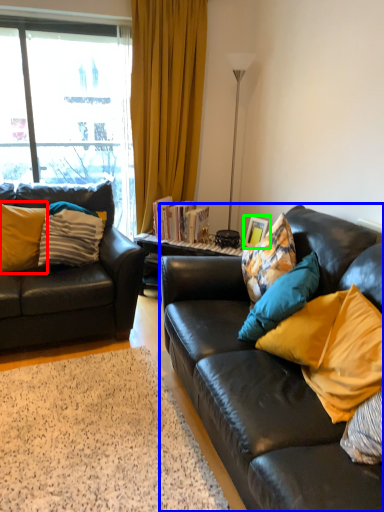
Question: Which is farther away from pillow (highlighted by a red box)? studio couch (highlighted by a blue box) or picture frame (highlighted by a green box)?

Choices:
 (A) studio couch
 (B) picture frame

Answer: (B)